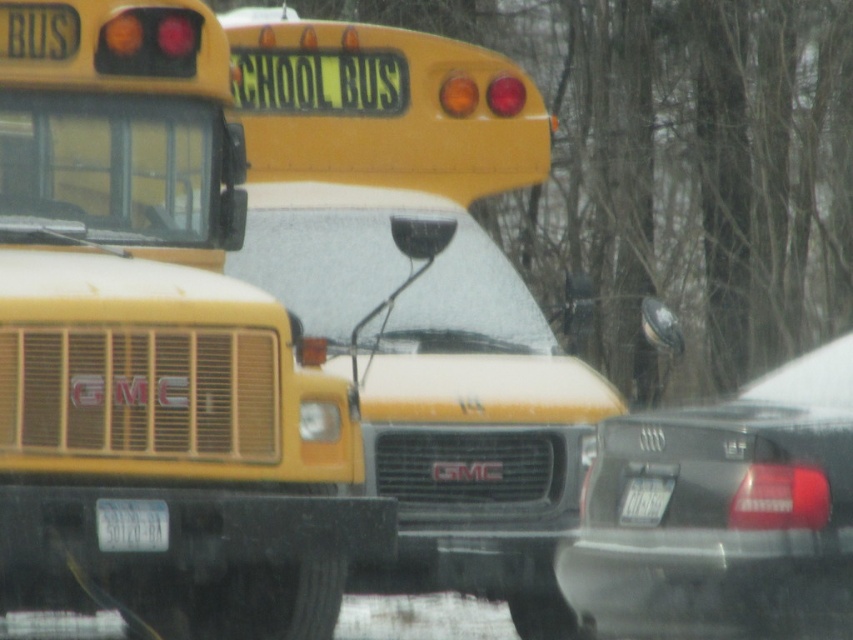
Who is more forward, (720, 627) or (125, 520)?

Point (720, 627) is in front.

Does matte black sedan at right have a lesser width compared to white plastic license plate at lower center?

Incorrect, matte black sedan at right's width is not less than white plastic license plate at lower center's.

Who is more forward, (770, 467) or (144, 529)?

Positioned in front is point (770, 467).

Where is `matte black sedan at right`? The image size is (853, 640). matte black sedan at right is located at coordinates (726, 515).

Is white plastic license plate at lower center wider than white plastic license plate at center?

Correct, the width of white plastic license plate at lower center exceeds that of white plastic license plate at center.

Identify the location of white plastic license plate at lower center. (131, 524).

Looking at this image, between matte black sedan at right and white plastic license plate at center, which one is positioned lower?

white plastic license plate at center

Describe the element at coordinates (726, 515) in the screenshot. I see `matte black sedan at right` at that location.

This screenshot has height=640, width=853. Identify the location of matte black sedan at right. (726, 515).